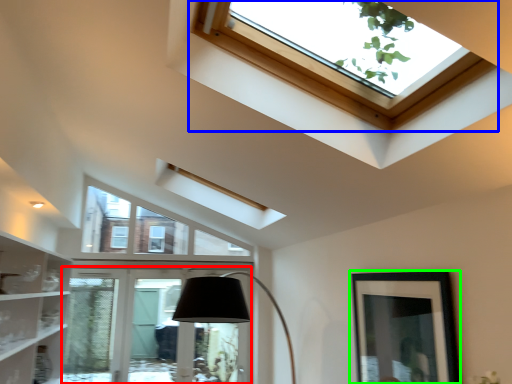
Question: Considering the real-world distances, which object is farthest from glass door (highlighted by a red box)? window (highlighted by a blue box) or picture frame (highlighted by a green box)?

Choices:
 (A) window
 (B) picture frame

Answer: (A)